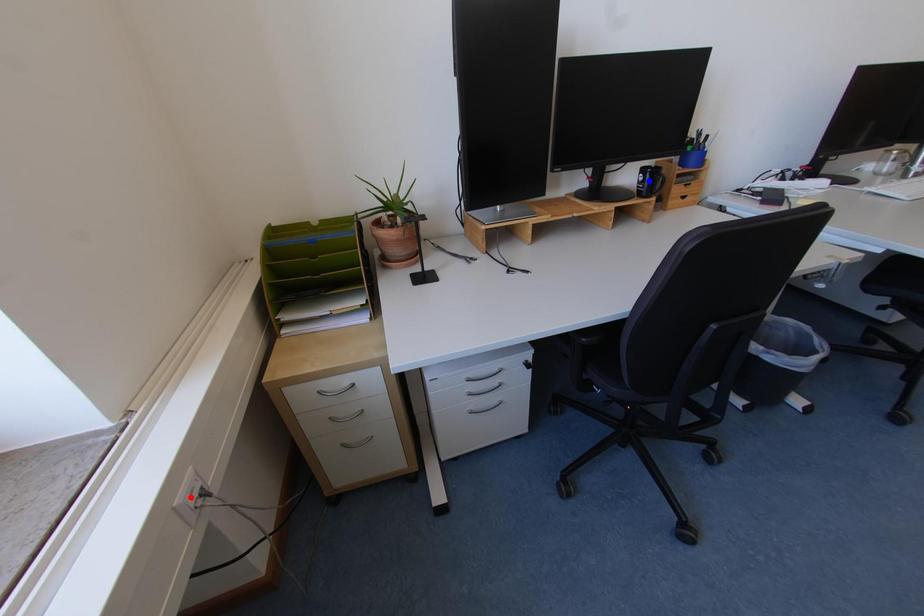
Question: Two points are marked on the image. Which point is closer to the camera?

Choices:
 (A) Blue point is closer.
 (B) Red point is closer.

Answer: (B)